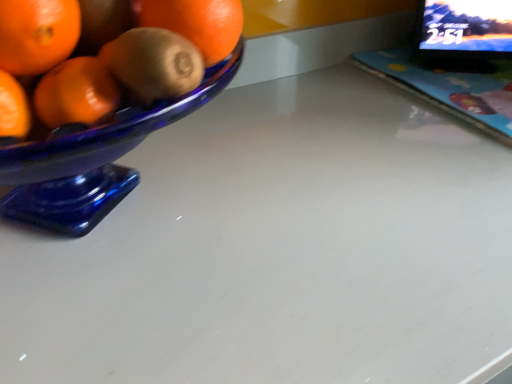
Question: From the image's perspective, is matte plastic laptop at upper right over black glossy computer monitor at upper right?

Choices:
 (A) no
 (B) yes

Answer: (A)

Question: Is matte plastic laptop at upper right wider than black glossy computer monitor at upper right?

Choices:
 (A) yes
 (B) no

Answer: (A)

Question: Considering the relative sizes of matte plastic laptop at upper right and black glossy computer monitor at upper right in the image provided, is matte plastic laptop at upper right smaller than black glossy computer monitor at upper right?

Choices:
 (A) yes
 (B) no

Answer: (A)

Question: Is matte plastic laptop at upper right not near black glossy computer monitor at upper right?

Choices:
 (A) yes
 (B) no

Answer: (B)

Question: From a real-world perspective, is matte plastic laptop at upper right on top of black glossy computer monitor at upper right?

Choices:
 (A) yes
 (B) no

Answer: (B)

Question: Can you confirm if matte plastic laptop at upper right is bigger than black glossy computer monitor at upper right?

Choices:
 (A) yes
 (B) no

Answer: (B)

Question: Considering the relative sizes of black glossy computer monitor at upper right and matte plastic laptop at upper right in the image provided, is black glossy computer monitor at upper right smaller than matte plastic laptop at upper right?

Choices:
 (A) yes
 (B) no

Answer: (B)

Question: Considering the relative sizes of black glossy computer monitor at upper right and matte plastic laptop at upper right in the image provided, is black glossy computer monitor at upper right wider than matte plastic laptop at upper right?

Choices:
 (A) no
 (B) yes

Answer: (A)

Question: Is matte plastic laptop at upper right a part of black glossy computer monitor at upper right?

Choices:
 (A) yes
 (B) no

Answer: (B)

Question: Does black glossy computer monitor at upper right have a lesser width compared to matte plastic laptop at upper right?

Choices:
 (A) no
 (B) yes

Answer: (B)

Question: Does black glossy computer monitor at upper right have a larger size compared to matte plastic laptop at upper right?

Choices:
 (A) no
 (B) yes

Answer: (B)

Question: From the image's perspective, would you say black glossy computer monitor at upper right is shown under matte plastic laptop at upper right?

Choices:
 (A) yes
 (B) no

Answer: (B)

Question: Is black glossy computer monitor at upper right in front of or behind matte plastic laptop at upper right in the image?

Choices:
 (A) behind
 (B) front

Answer: (A)